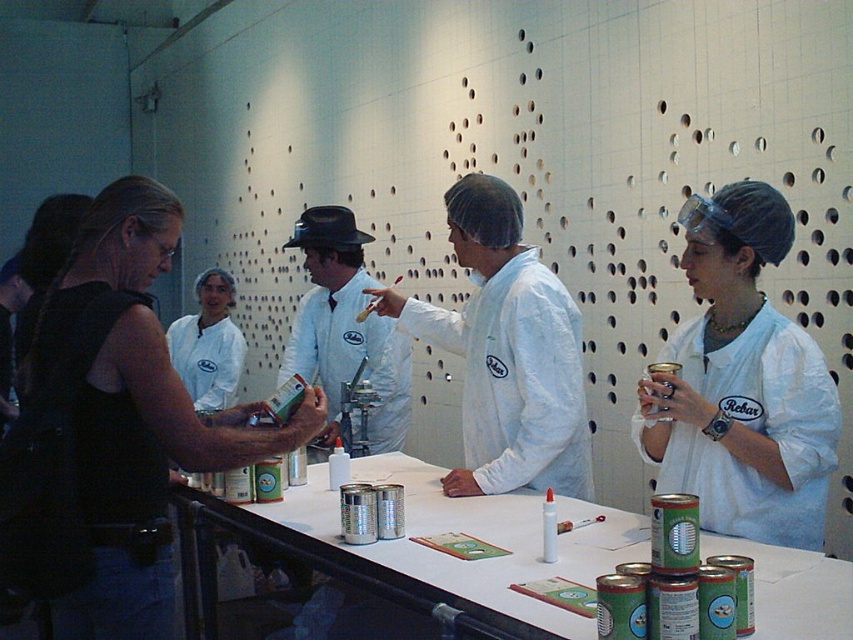
Question: Which object is the farthest from the white fabric shirt at center?

Choices:
 (A) black fabric vest at left
 (B) white matte lab coat at right
 (C) white paper table at center

Answer: (B)

Question: Is white paper table at center below white matte uniform at center?

Choices:
 (A) no
 (B) yes

Answer: (B)

Question: Which object is farther from the camera taking this photo?

Choices:
 (A) black fabric vest at left
 (B) white matte lab coat at right
 (C) white paper table at center
 (D) white matte uniform at center

Answer: (D)

Question: Is white paper table at center to the right of white matte uniform at center from the viewer's perspective?

Choices:
 (A) yes
 (B) no

Answer: (A)

Question: Does white lab coat at center have a lesser width compared to white matte uniform at center?

Choices:
 (A) yes
 (B) no

Answer: (B)

Question: Which point is closer to the camera?

Choices:
 (A) white matte lab coat at right
 (B) black fabric vest at left

Answer: (B)